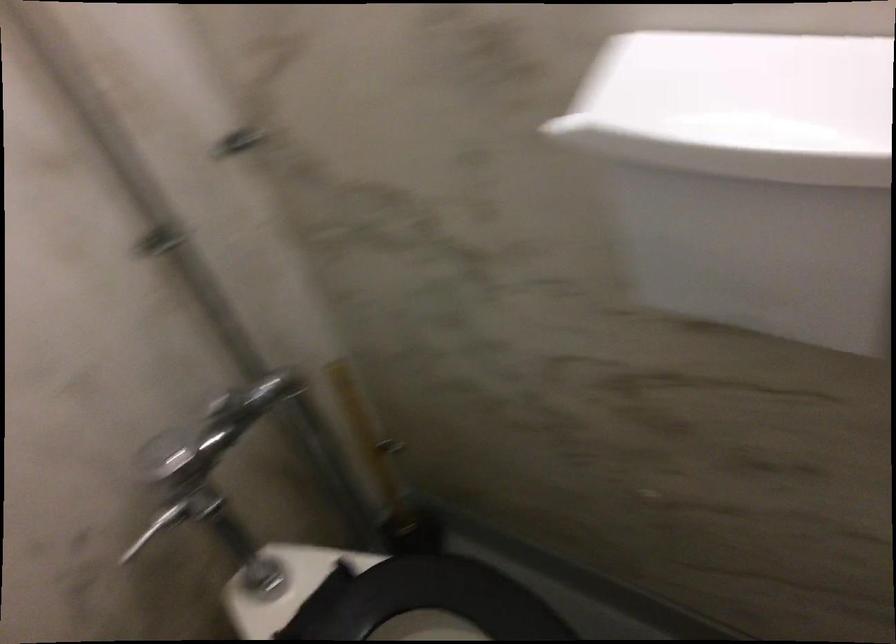
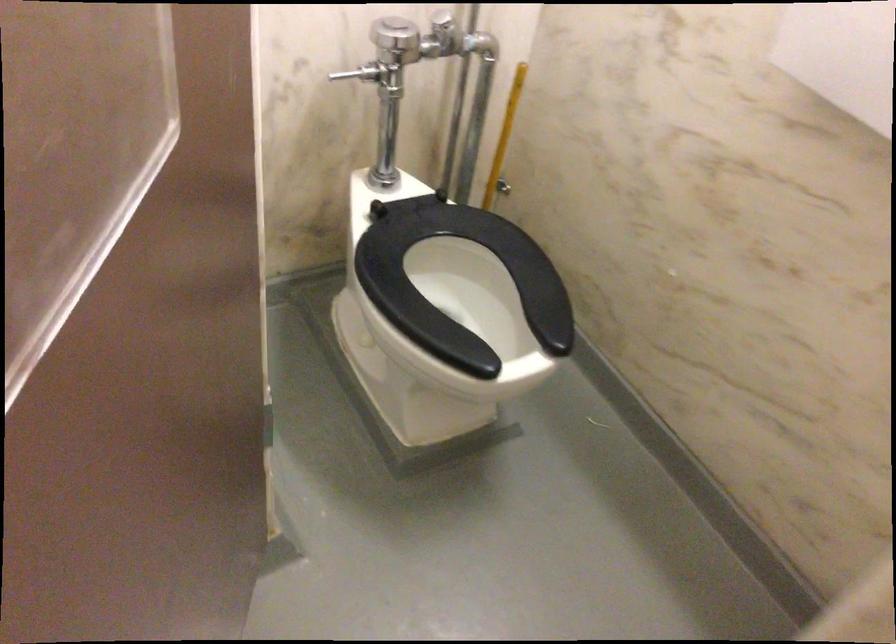
Locate, in the second image, the point that corresponds to (371,429) in the first image.

(504, 137)